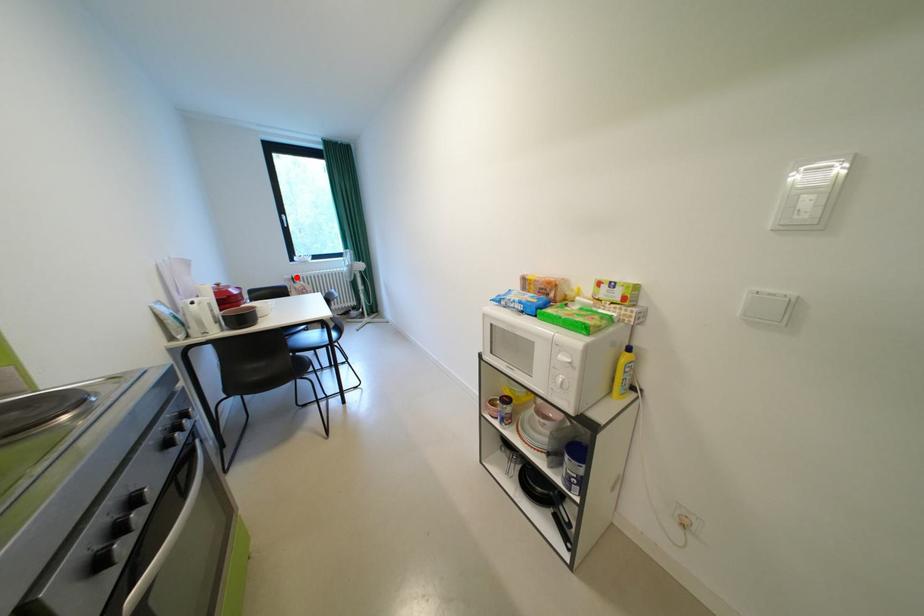
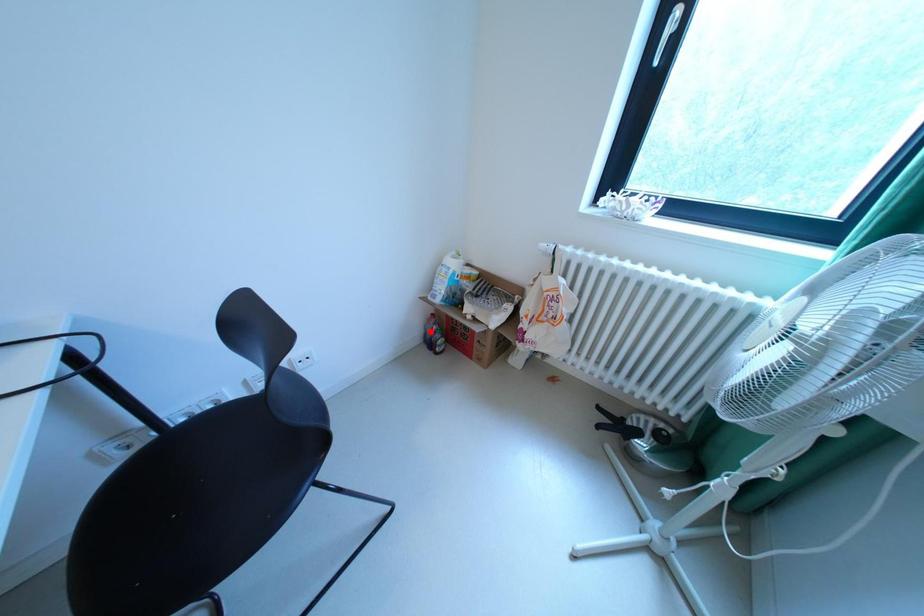
I am providing you with two images of the same scene from different viewpoints. A red point is marked on the first image and another point is marked on the second image. Does the point marked in image1 correspond to the same location as the one in image2?

No